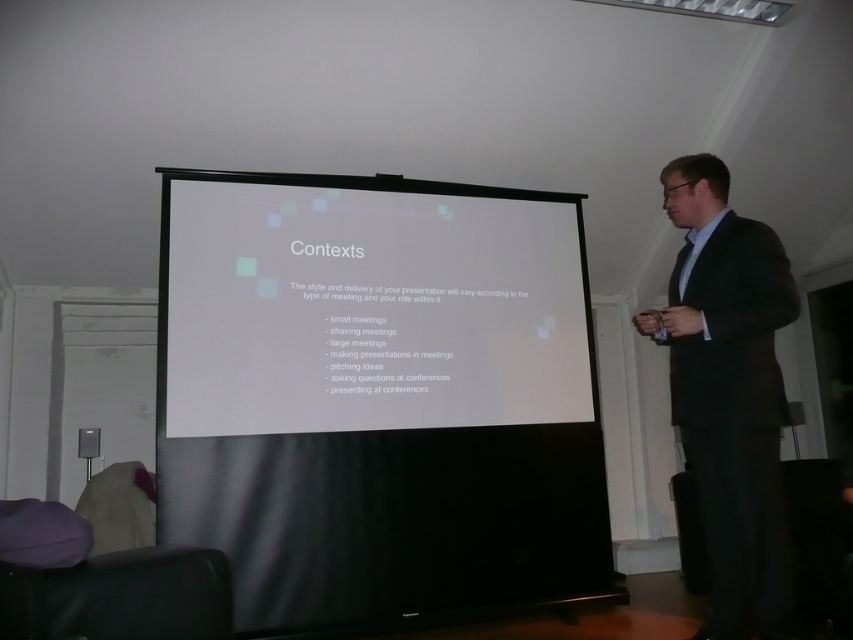
You are an event planner setting up a conference room. You need to place a new projector that will project onto the white matte projection screen at center and ensure the black suit at right is not in the way. Based on the scene, which side of the screen should you position the projector to avoid the person?

The white matte projection screen at center is positioned on the left side of the black suit at right. To avoid the person in the black suit at right, the projector should be placed on the left side of the screen so that the light projects towards the right, away from the presenter.

You are organizing a presentation and need to ensure that the white matte projection screen at center is visible to all attendees. Considering the black suit at right is where the presenter will stand, will the screen be positioned centrally enough for the audience to see it comfortably?

The white matte projection screen at center is positioned centrally, which ensures that it is visible to all attendees, even with the presenter standing at the black suit at right. The central placement should provide a comfortable viewing angle for the audience.